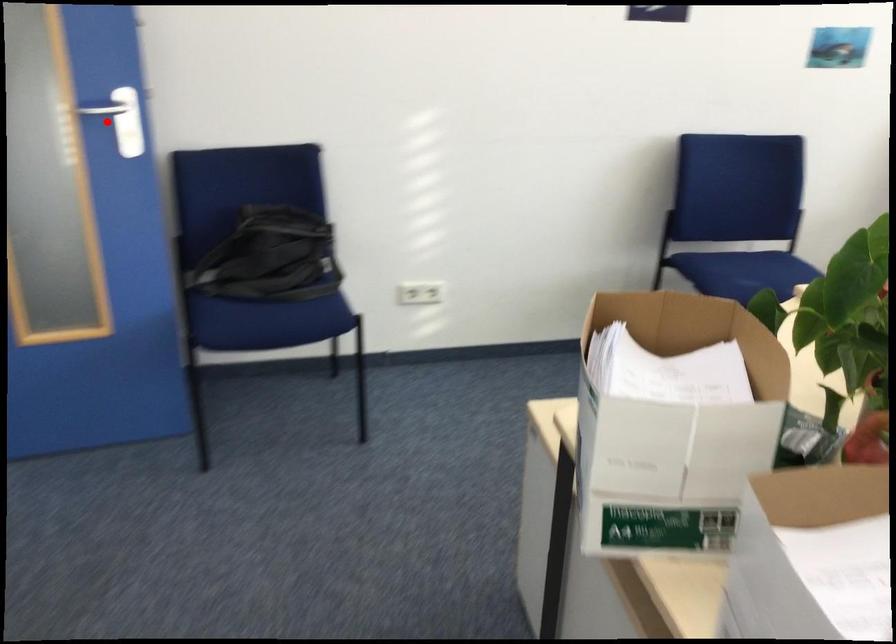
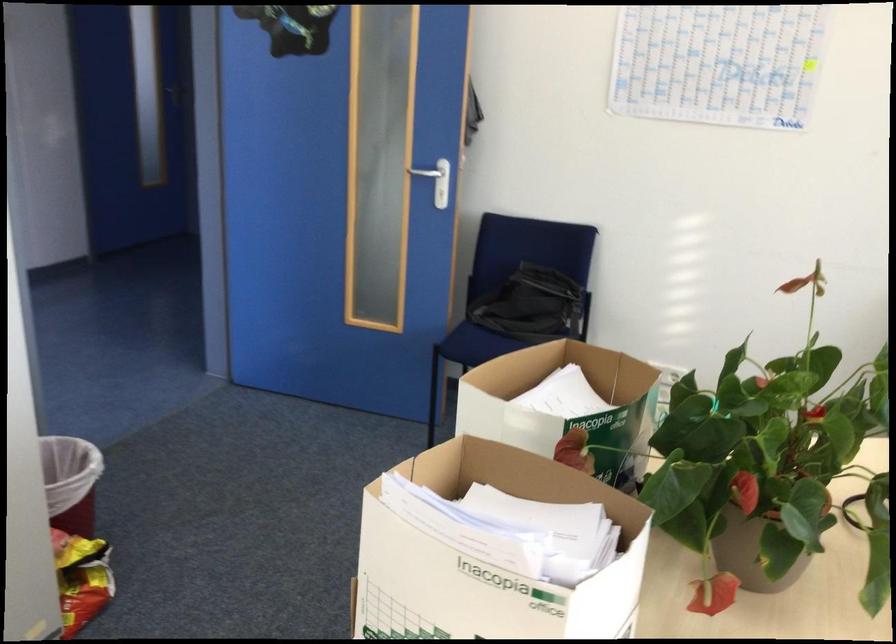
Question: I am providing you with two images of the same scene from different viewpoints. Given a red point in image1, look at the same physical point in image2. Is it:

Choices:
 (A) Closer to the viewpoint
 (B) Farther from the viewpoint

Answer: (B)